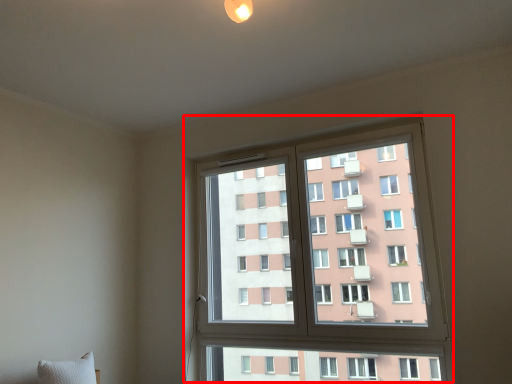
Question: From the image's perspective, where is window (annotated by the red box) located in relation to pillow in the image?

Choices:
 (A) below
 (B) above

Answer: (B)